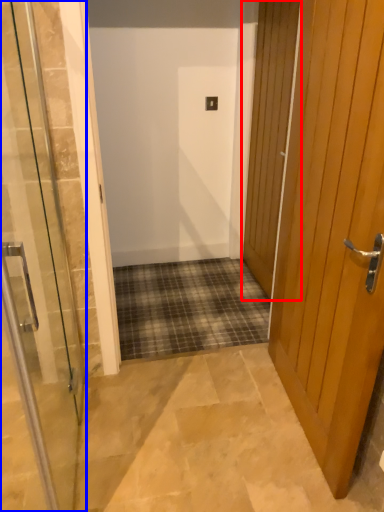
Question: Which point is further to the camera, door (highlighted by a red box) or door (highlighted by a blue box)?

Choices:
 (A) door
 (B) door

Answer: (A)